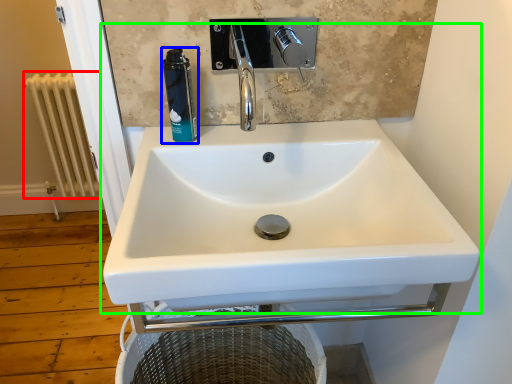
Question: Which object is positioned farthest from radiator (highlighted by a red box)? Select from mouthwash (highlighted by a blue box) and sink (highlighted by a green box).

Choices:
 (A) mouthwash
 (B) sink

Answer: (B)